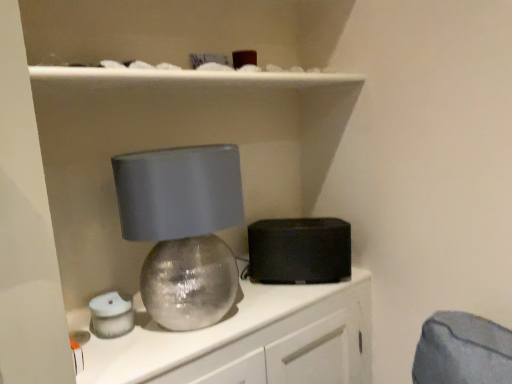
Question: Is black matte speaker at center wider than matte silver sphere at center?

Choices:
 (A) yes
 (B) no

Answer: (B)

Question: Does black matte speaker at center have a larger size compared to matte silver sphere at center?

Choices:
 (A) yes
 (B) no

Answer: (B)

Question: Is black matte speaker at center at the right side of matte silver sphere at center?

Choices:
 (A) yes
 (B) no

Answer: (A)

Question: Is matte silver sphere at center surrounded by black matte speaker at center?

Choices:
 (A) no
 (B) yes

Answer: (A)

Question: Is black matte speaker at center taller than matte silver sphere at center?

Choices:
 (A) yes
 (B) no

Answer: (B)

Question: Considering their positions, is black matte speaker at center located in front of or behind matte silver sphere at center?

Choices:
 (A) front
 (B) behind

Answer: (B)

Question: Is black matte speaker at center spatially inside matte silver sphere at center, or outside of it?

Choices:
 (A) outside
 (B) inside

Answer: (A)

Question: From a real-world perspective, is black matte speaker at center positioned above or below matte silver sphere at center?

Choices:
 (A) below
 (B) above

Answer: (B)

Question: Looking at the image, does black matte speaker at center seem bigger or smaller compared to matte silver sphere at center?

Choices:
 (A) small
 (B) big

Answer: (A)

Question: From their relative heights in the image, would you say black matte speaker at center is taller or shorter than matte gray lampshade at center?

Choices:
 (A) short
 (B) tall

Answer: (A)

Question: Does point (288, 276) appear closer or farther from the camera than point (204, 193)?

Choices:
 (A) closer
 (B) farther

Answer: (B)

Question: In the image, is black matte speaker at center on the left side or the right side of matte gray lampshade at center?

Choices:
 (A) left
 (B) right

Answer: (B)

Question: From a real-world perspective, is black matte speaker at center physically located above or below matte gray lampshade at center?

Choices:
 (A) above
 (B) below

Answer: (B)

Question: In terms of width, does matte gray lampshade at center look wider or thinner when compared to black matte speaker at center?

Choices:
 (A) wide
 (B) thin

Answer: (A)

Question: From the image's perspective, relative to black matte speaker at center, is matte gray lampshade at center above or below?

Choices:
 (A) below
 (B) above

Answer: (B)